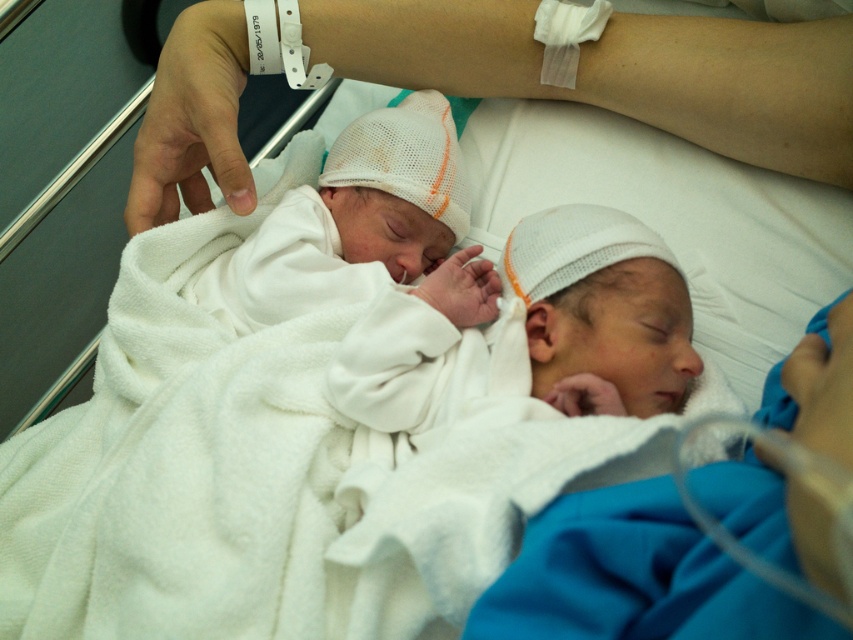
Can you confirm if white knit cap at center is smaller than white soft blanket at center?

No.

Does white knit cap at center have a lesser height compared to white soft blanket at center?

Incorrect, white knit cap at center's height does not fall short of white soft blanket at center's.

Is point (399, 314) farther from camera compared to point (664, 525)?

Yes.

I want to click on white knit cap at center, so click(x=523, y=337).

The height and width of the screenshot is (640, 853). Describe the element at coordinates (523, 337) in the screenshot. I see `white knit cap at center` at that location.

Does white knit cap at center have a greater height compared to white mesh hat at center?

No, white knit cap at center is not taller than white mesh hat at center.

Who is more forward, (660, 246) or (366, 193)?

Positioned in front is point (660, 246).

The height and width of the screenshot is (640, 853). Identify the location of white knit cap at center. (523, 337).

Is white soft blanket at center shorter than white mesh hat at center?

Yes.

Can you confirm if white soft blanket at center is positioned below white mesh hat at center?

Yes.

Where is `white soft blanket at center`? This screenshot has width=853, height=640. white soft blanket at center is located at coordinates (631, 577).